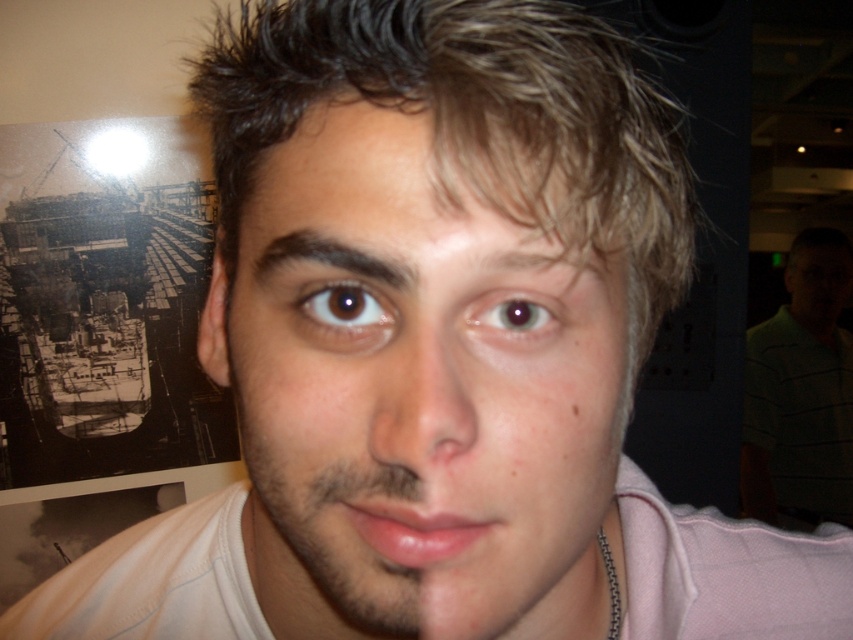
Question: Where is pink glossy lips at center located in relation to brown glossy eye at center in the image?

Choices:
 (A) below
 (B) above

Answer: (A)

Question: Which object is closer to the camera taking this photo?

Choices:
 (A) blonde hair at center
 (B) pink glossy lips at center
 (C) brown shiny eye at center
 (D) smooth skin face at center

Answer: (D)

Question: Can you confirm if smooth skin nose at center is bigger than pink glossy lips at center?

Choices:
 (A) no
 (B) yes

Answer: (B)

Question: Which point appears closest to the camera in this image?

Choices:
 (A) click(x=796, y=490)
 (B) click(x=364, y=442)

Answer: (B)

Question: Does pink glossy lips at center appear on the right side of brown glossy eye at center?

Choices:
 (A) yes
 (B) no

Answer: (B)

Question: Which of these objects is positioned farthest from the smooth skin nose at center?

Choices:
 (A) green striped shirt at right
 (B) pink glossy lips at center
 (C) smooth skin face at center

Answer: (A)